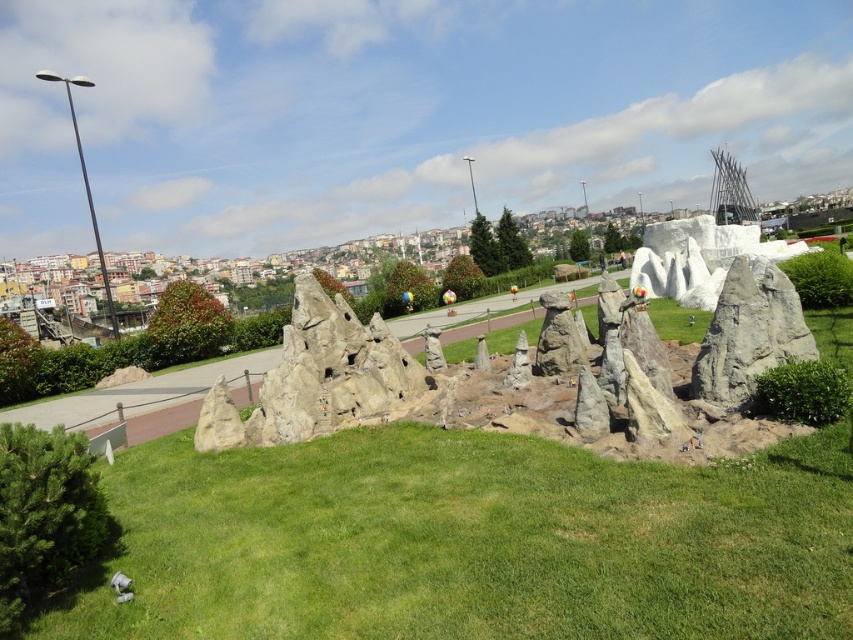
Question: Does rough stone rock formation at center have a smaller size compared to gray stone rock formation at center-right?

Choices:
 (A) no
 (B) yes

Answer: (A)

Question: Among these points, which one is nearest to the camera?

Choices:
 (A) (158, 496)
 (B) (788, 317)

Answer: (A)

Question: Can you confirm if rough stone rock formation at center is positioned above gray stone rock formation at center-right?

Choices:
 (A) yes
 (B) no

Answer: (A)

Question: Which of the following is the farthest from the observer?

Choices:
 (A) gray stone rock formation at center-right
 (B) rough stone rock formation at center

Answer: (A)

Question: Which of the following is the farthest from the observer?

Choices:
 (A) rough stone rock formation at center
 (B) gray stone rock formation at center-right

Answer: (B)

Question: Can you confirm if rough stone rock formation at center is positioned to the right of gray stone rock formation at center-right?

Choices:
 (A) no
 (B) yes

Answer: (A)